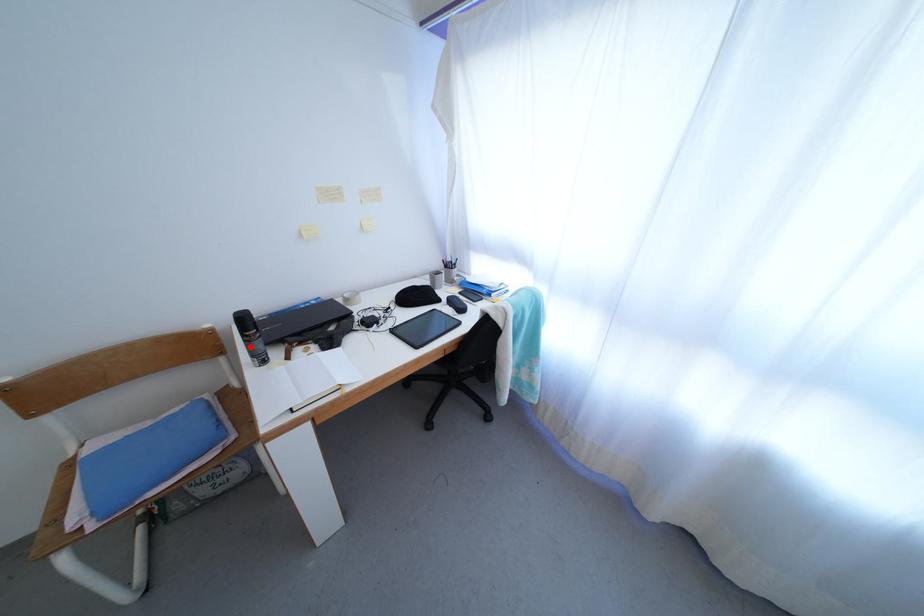
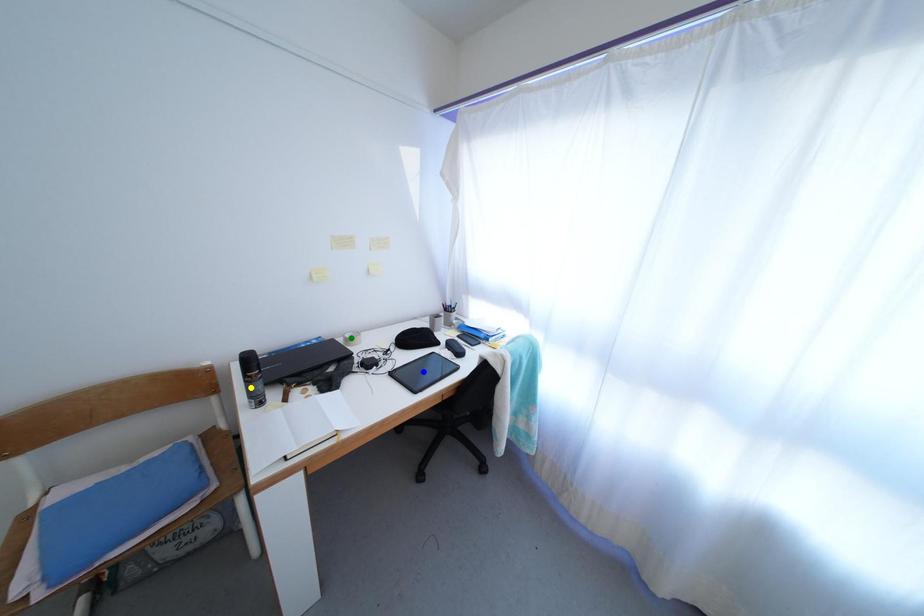
Question: I am providing you with two images of the same scene from different viewpoints. A red point is marked on the first image. You are given multiple points on the second image. Which point in image 2 represents the same 3d spot as the red point in image 1?

Choices:
 (A) yellow point
 (B) blue point
 (C) green point

Answer: (A)